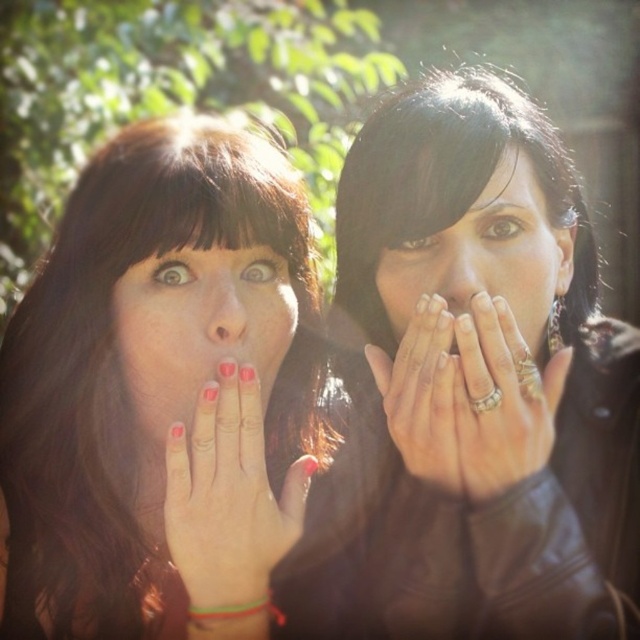
You are a photographer trying to capture a closeup of the silver metallic ring at center. However, the matte black jacket at center is blocking your view. Can you still get a clear shot of the ring without moving the jacket?

The matte black jacket at center is in front of the silver metallic ring at center, so it is blocking the view. You cannot get a clear shot of the ring without moving the jacket.

You are a photographer trying to capture a closeup shot of the matte red nails at center and the matte black face at center. Which object should you zoom in more on to ensure both are in focus?

The matte red nails at center is smaller than the matte black face at center, so you should zoom in more on the matte red nails at center to ensure both are in focus.

You are a photographer trying to capture a closeup shot of the silver metallic ring at center. You notice the matte black jacket at center is blocking your view. Based on their positions, can you adjust your angle to see the ring without moving the jacket?

The matte black jacket at center is above the silver metallic ring at center, so you can lower your camera angle slightly to see the ring below the jacket.